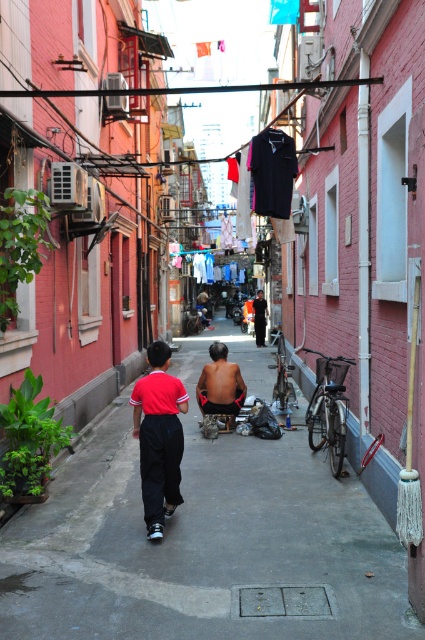
You are a delivery person trying to navigate through the narrow alleyway. There is a skinny man at center and a dark gray fabric jacket at center in your path. Can you pass through between them without touching either?

The skinny man at center is narrower than the dark gray fabric jacket at center. Since the alleyway is narrow and the jacket is wider, you might not have enough space to pass between them safely. It would be best to wait until the jacket is removed or find an alternative route.

Looking at this image, you are a delivery person trying to navigate through the alley. You see the smooth concrete pavement at center and the skinny man at center. Which object is wider?

The smooth concrete pavement at center is wider than the skinny man at center.